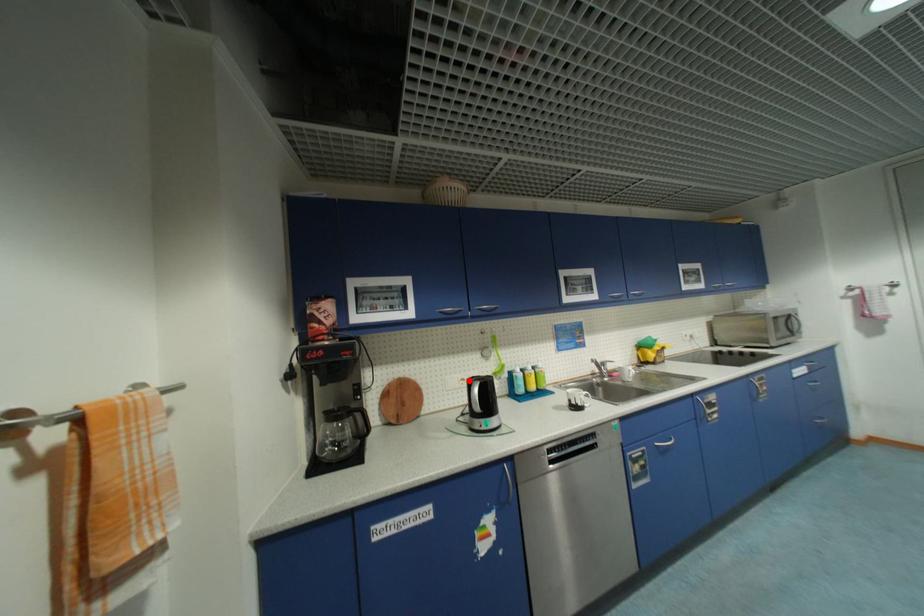
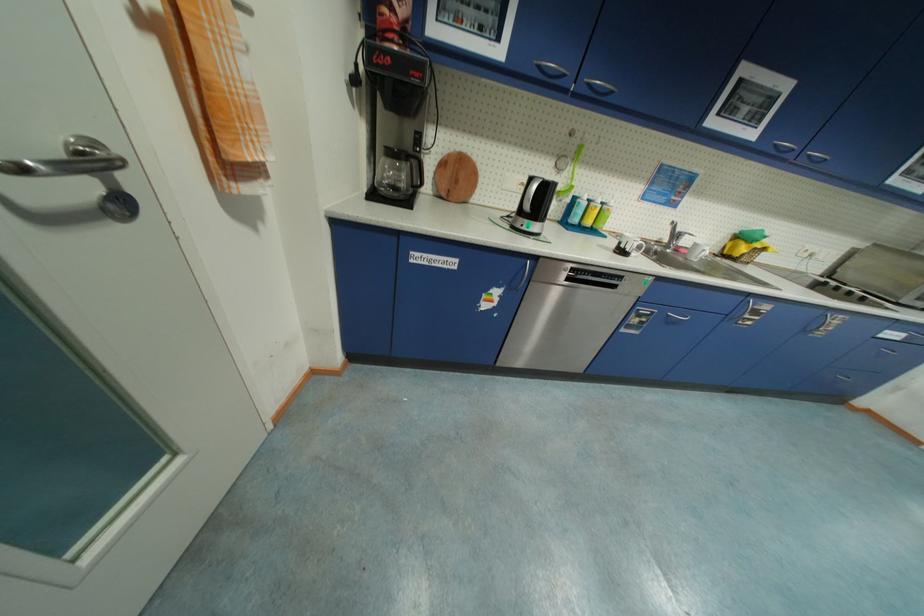
Question: I am providing you with two images of the same scene from different viewpoints. In image1, a red point is highlighted. Considering the same 3D point in image2, which of the following is correct?

Choices:
 (A) It is closer
 (B) It is farther

Answer: (A)